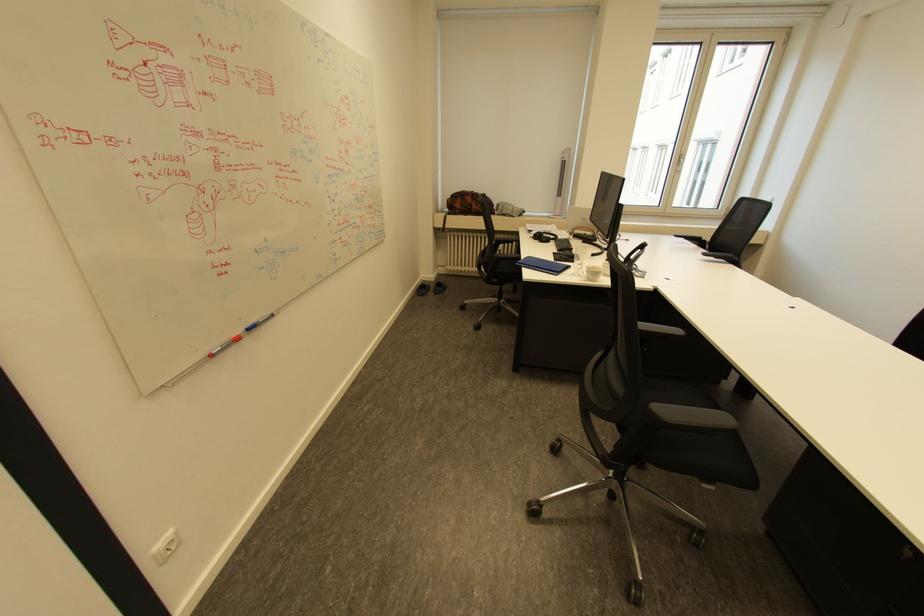
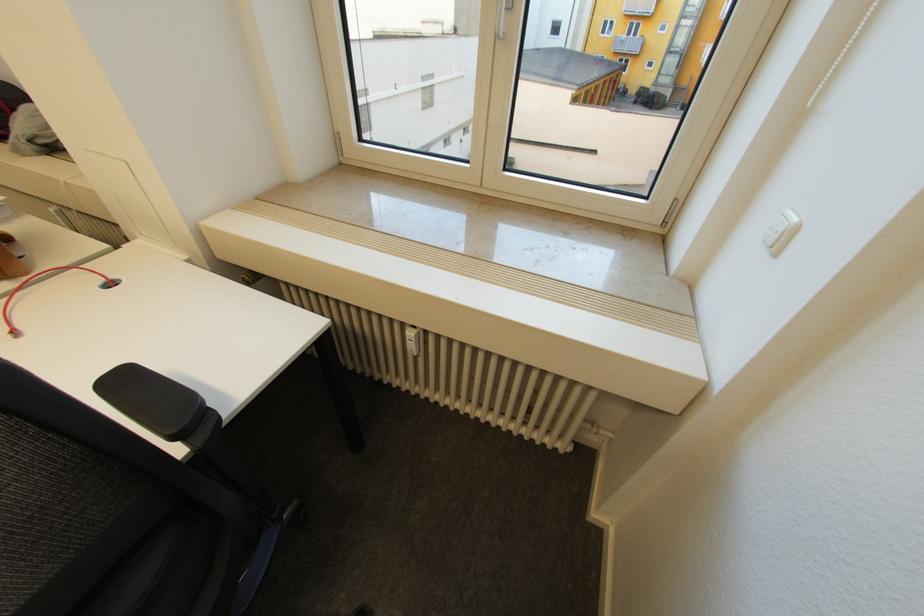
What movement of the cameraman would produce the second image?

The cameraman moved toward right, forward.